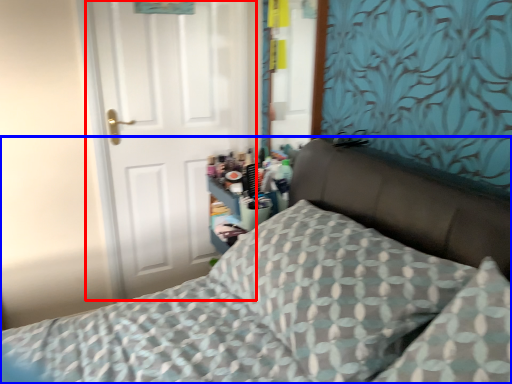
Question: Which point is closer to the camera, door (highlighted by a red box) or bed (highlighted by a blue box)?

Choices:
 (A) door
 (B) bed

Answer: (B)